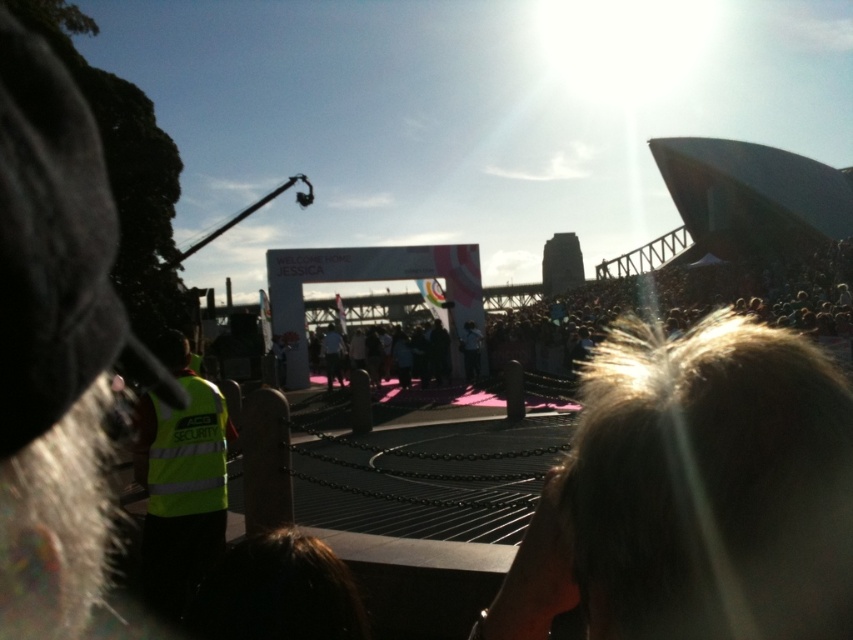
You are a photographer at the event and want to capture a wide shot of the crowd while including the security vest in the frame. Given the camera you have can only focus on objects wider than 20cm, will both the neon yellow reflective vest at lower left and the pink fabric crowd at center be in focus?

The neon yellow reflective vest at lower left is narrower than the pink fabric crowd at center. Since the camera requires objects wider than 20cm to focus, only the pink fabric crowd at center will be in focus.

You are a photographer at the event and want to capture a photo of the Sydney Opera House backdrop without any obstructions. You have two options for your vantage point. The first option is to stand behind the neon yellow reflective vest at lower left, and the second is to stand behind the pink fabric crowd at center. Which position would allow you to see the Sydney Opera House backdrop more clearly?

The neon yellow reflective vest at lower left is below the pink fabric crowd at center. Standing behind the neon yellow reflective vest at lower left would provide a clearer view of the Sydney Opera House backdrop since it is positioned lower and not obstructed by the pink fabric crowd at center which is above it.